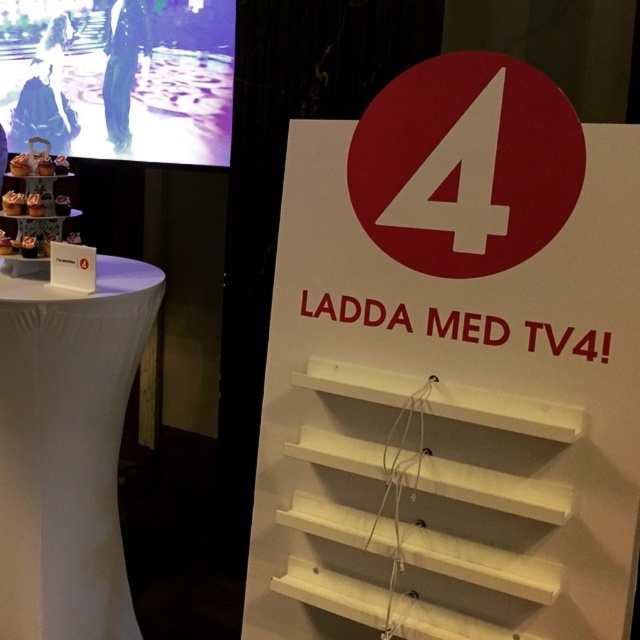
Question: Does white wood sign at center come behind white fabric-covered table at left?

Choices:
 (A) yes
 (B) no

Answer: (B)

Question: Which point is closer to the camera taking this photo?

Choices:
 (A) (113, 451)
 (B) (336, 314)

Answer: (B)

Question: Is white wood sign at center smaller than white fabric-covered table at left?

Choices:
 (A) yes
 (B) no

Answer: (B)

Question: Can you confirm if white wood sign at center is bigger than white fabric-covered table at left?

Choices:
 (A) no
 (B) yes

Answer: (B)